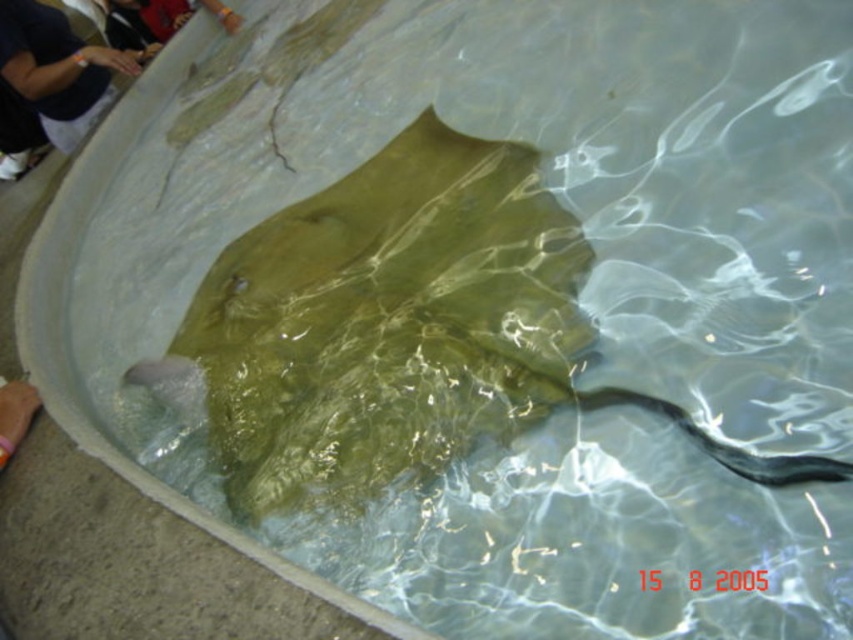
You are standing at the edge of the pool and see the point marked at coordinates (387, 323). What is located at that point?

The point marked at coordinates (387, 323) marks the greenish brown glossy stingray at center.